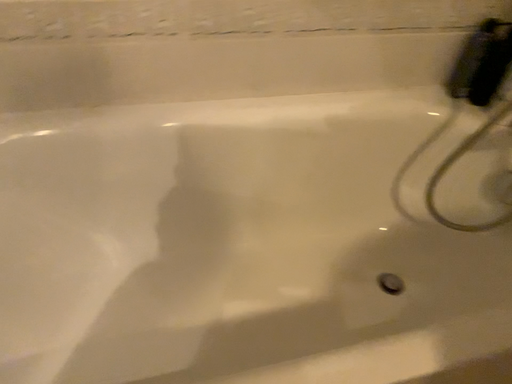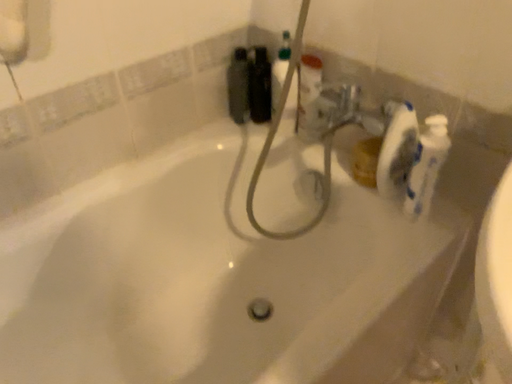
Question: How did the camera likely rotate when shooting the video?

Choices:
 (A) rotated right
 (B) rotated left

Answer: (A)